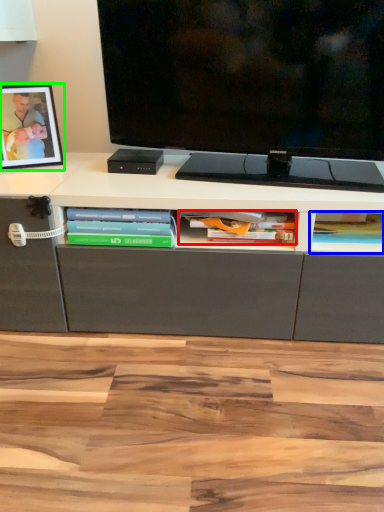
Question: Which is nearer to the book (highlighted by a red box)? book (highlighted by a blue box) or picture frame (highlighted by a green box).

Choices:
 (A) book
 (B) picture frame

Answer: (A)